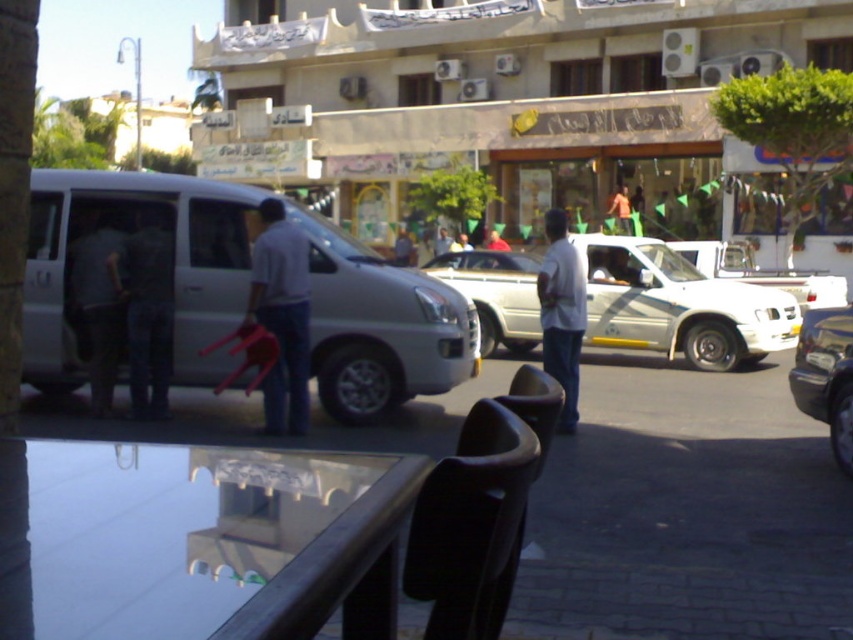
Question: Can you confirm if white matte truck at center is positioned to the left of dark gray fabric at left?

Choices:
 (A) no
 (B) yes

Answer: (A)

Question: Does dark gray fabric shirt at left appear under white cotton shirt at center?

Choices:
 (A) yes
 (B) no

Answer: (A)

Question: Which object is positioned closest to the white matte shirt at center?

Choices:
 (A) white matte truck at center
 (B) dark gray fabric at left
 (C) dark gray fabric shirt at left
 (D) white cotton shirt at center

Answer: (C)

Question: Which object is positioned closest to the white matte shirt at center?

Choices:
 (A) dark gray fabric at left
 (B) white cotton shirt at center
 (C) white matte truck at center
 (D) dark gray fabric shirt at left

Answer: (D)

Question: Among these points, which one is nearest to the camera?

Choices:
 (A) (560, 280)
 (B) (289, 234)

Answer: (B)

Question: Is the position of dark gray fabric shirt at left more distant than that of dark gray fabric at left?

Choices:
 (A) no
 (B) yes

Answer: (A)